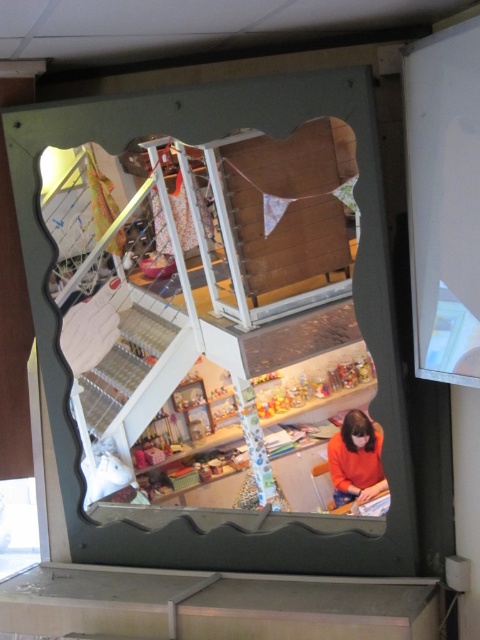
You are a customer in the shop and want to see both the clear glass mirror at center and the orange matte sweater at lower right. Which object is higher up in the reflection?

The clear glass mirror at center is taller than the orange matte sweater at lower right, so it is higher up in the reflection.

You are a delivery person who needs to place a package that is 1.5 meters long between the clear glass mirror at center and the orange matte sweater at lower right. Can you fit the package between them without bending it?

The clear glass mirror at center and orange matte sweater at lower right are 1.34 meters apart from each other. Since the package is 1.5 meters long, which is longer than the available space, it cannot be placed between them without bending.